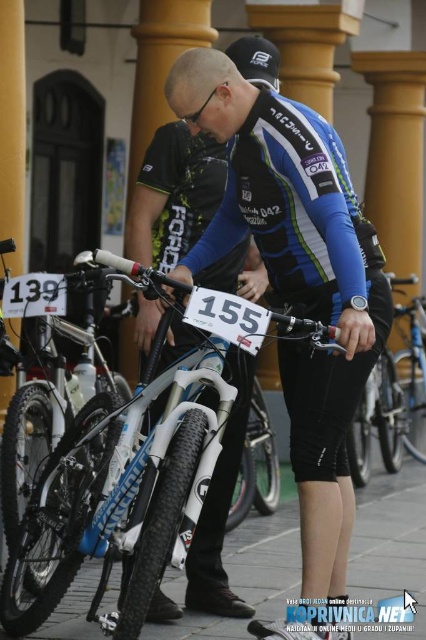
You are a photographer at the cycling event. You need to capture a photo where both the shiny silver bike at center and the black matte bicycle helmet at upper center are clearly visible. Based on their positions, which object is closer to the camera?

The black matte bicycle helmet at upper center is closer to the camera because it is positioned above the shiny silver bike at center, which suggests it is in front of it.